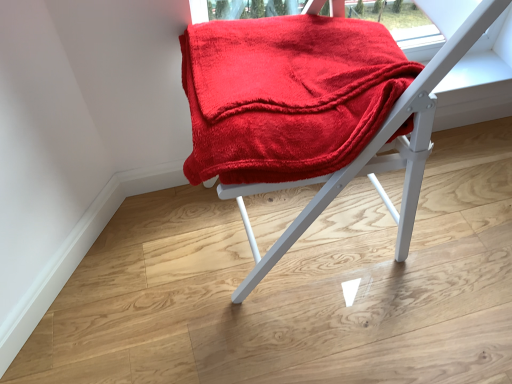
Where is `free space to the left of fuzzy red blanket at center`? Image resolution: width=512 pixels, height=384 pixels. free space to the left of fuzzy red blanket at center is located at coordinates (137, 270).